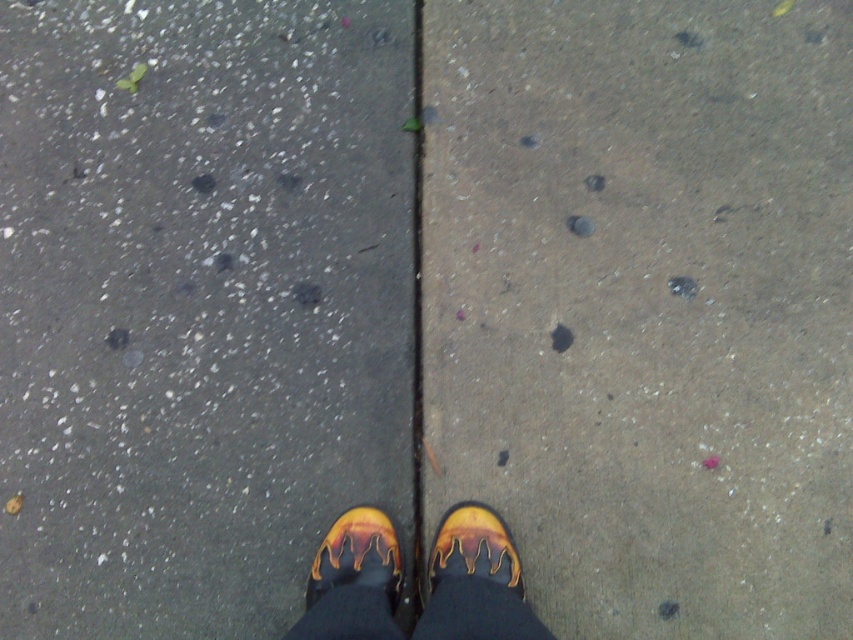
You are a construction worker who needs to step onto the concrete at center. Your yellow rubber boots at center must fit entirely on the concrete. Based on the scene, will your boots fit?

The concrete at center has a larger size compared to yellow rubber boots at center, so the boots will fit entirely on the concrete.